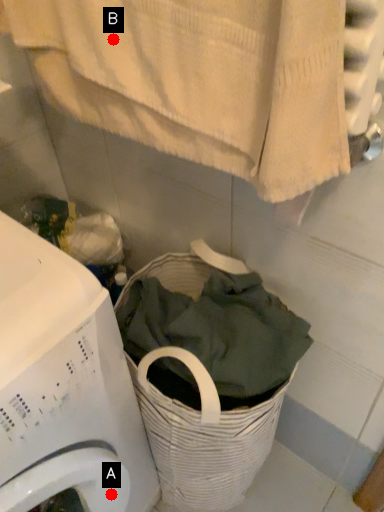
Question: Two points are circled on the image, labeled by A and B beside each circle. Which point is farther to the camera?

Choices:
 (A) A is further
 (B) B is further

Answer: (A)